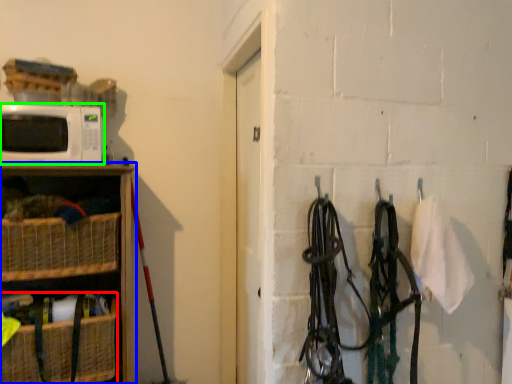
Question: Considering the real-world distances, which object is closest to basket (highlighted by a red box)? shelf (highlighted by a blue box) or microwave oven (highlighted by a green box).

Choices:
 (A) shelf
 (B) microwave oven

Answer: (A)